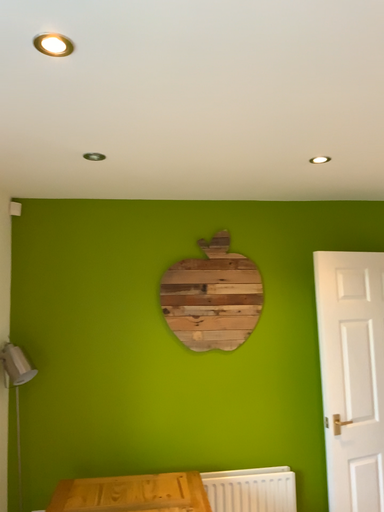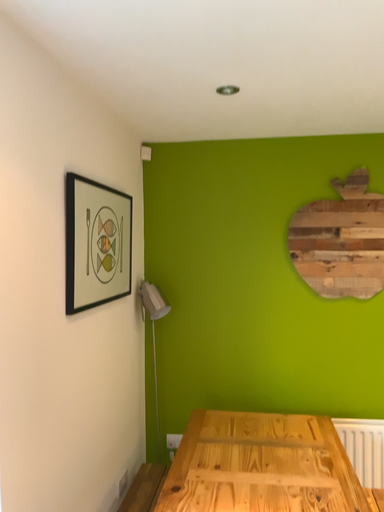
Question: Which way did the camera rotate in the video?

Choices:
 (A) rotated left
 (B) rotated right

Answer: (A)